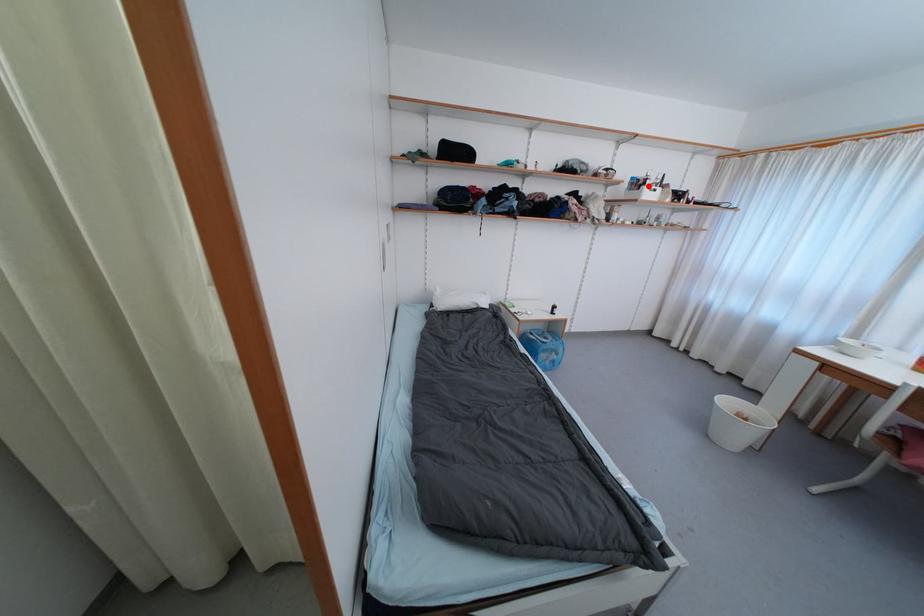
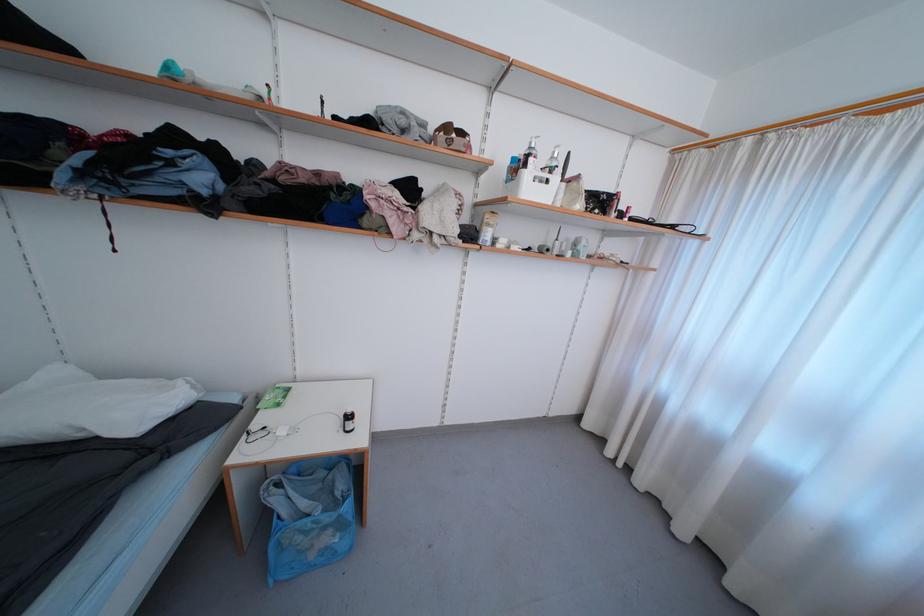
In the second image, find the point that corresponds to the highlighted location in the first image.

(529, 168)